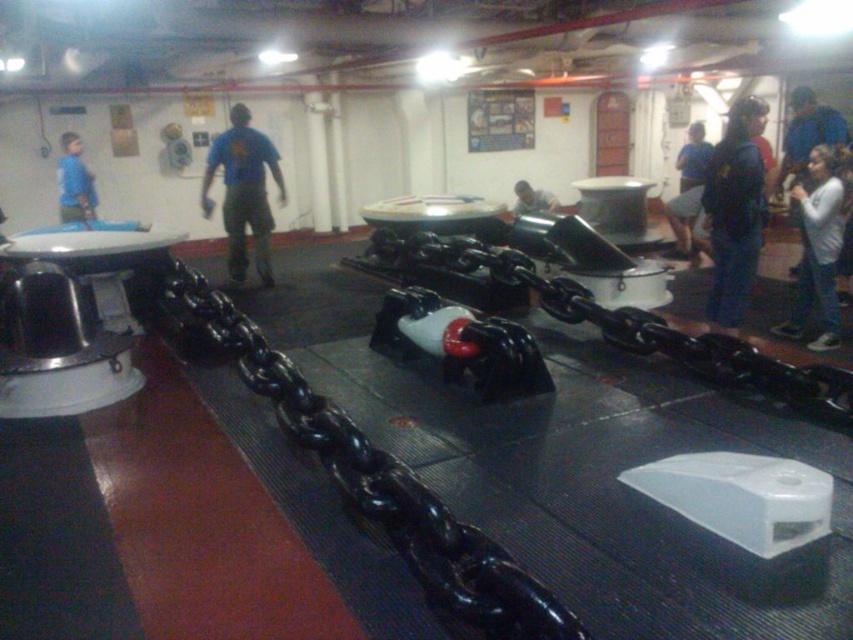
Question: Which of these objects is positioned farthest from the blue matte shirt at left?

Choices:
 (A) blue t-shirt at center
 (B) black glossy chain at center

Answer: (B)

Question: Does polished metal anchor at left lie in front of blue t-shirt at center?

Choices:
 (A) yes
 (B) no

Answer: (A)

Question: Is blue matte shirt at left positioned behind matte black helmet at center?

Choices:
 (A) yes
 (B) no

Answer: (B)

Question: Which point is farther to the camera?

Choices:
 (A) blue matte shirt at left
 (B) white cotton shirt at right
 (C) polished metal anchor at left

Answer: (A)

Question: Which is farther from the polished metal anchor at left?

Choices:
 (A) blue shirt at upper right
 (B) black glossy chain at center
 (C) blue matte shirt at left
 (D) blue t-shirt at center

Answer: (A)

Question: Is blue denim jeans at right above blue t-shirt at center?

Choices:
 (A) yes
 (B) no

Answer: (B)